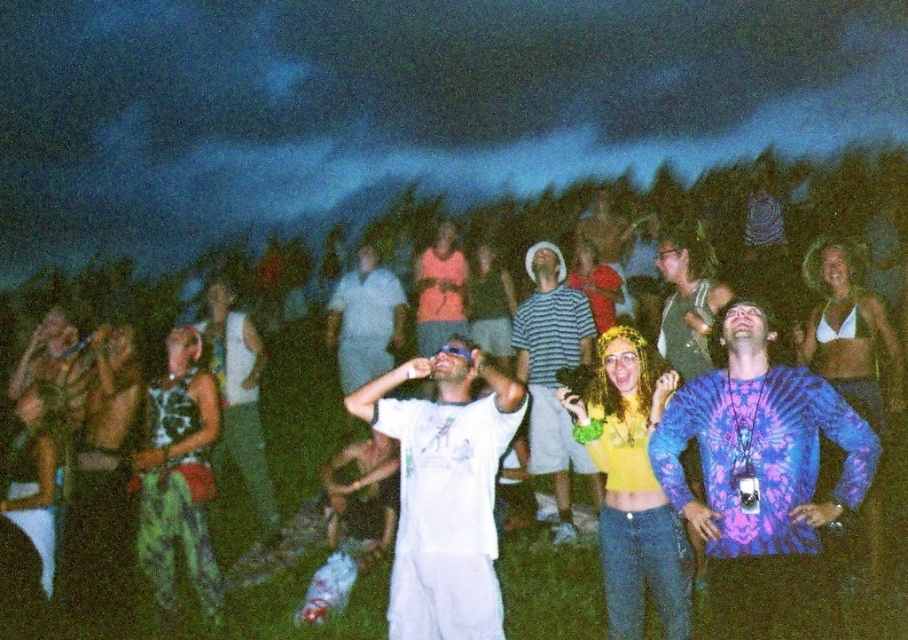
You are standing at the point with coordinates point (x=400, y=486) and want to move to the point with coordinates point (x=684, y=508). Given the scene described, would you need to walk around any obstacles or can you move directly towards your destination?

Since point (x=684, y=508) is in front of point (x=400, y=486), you can move directly towards your destination without needing to walk around any obstacles.

You are organizing a photo shoot and need to ensure that all participants are visible in the frame. Given the lighting conditions and the arrangement of the striped cotton shirt at center and white cotton shirt at center, which of the two shirts might be more challenging to capture clearly due to their size?

The striped cotton shirt at center occupies less space than white cotton shirt at center, so the striped cotton shirt at center might be more challenging to capture clearly because it is smaller and could be harder to focus on in the low light.